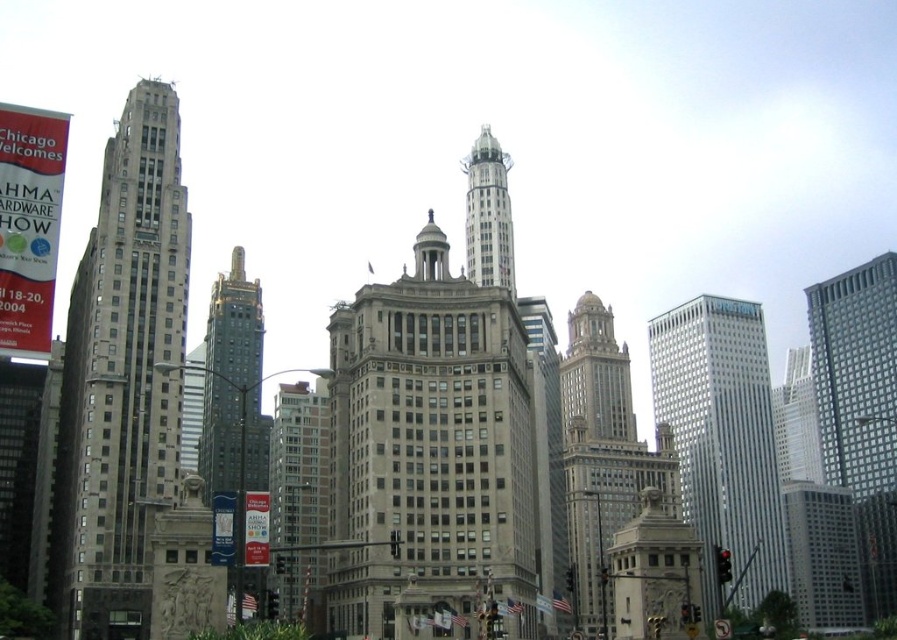
You are a city planner assessing the urban layout. You need to determine which of the two central buildings, the brick textured building at center or the white marble tower at center, has a greater width to accommodate more commercial spaces. Based on the scene, which building should you choose?

The brick textured building at center has a larger width than the white marble tower at center, making it more suitable for accommodating more commercial spaces.

You are an architect evaluating the urban skyline. You notice the gray glass skyscraper at right and the white marble tower at center. Which one has a greater height according to the architectural plans?

The gray glass skyscraper at right is bigger than the white marble tower at center, so it has a greater height according to the architectural plans.